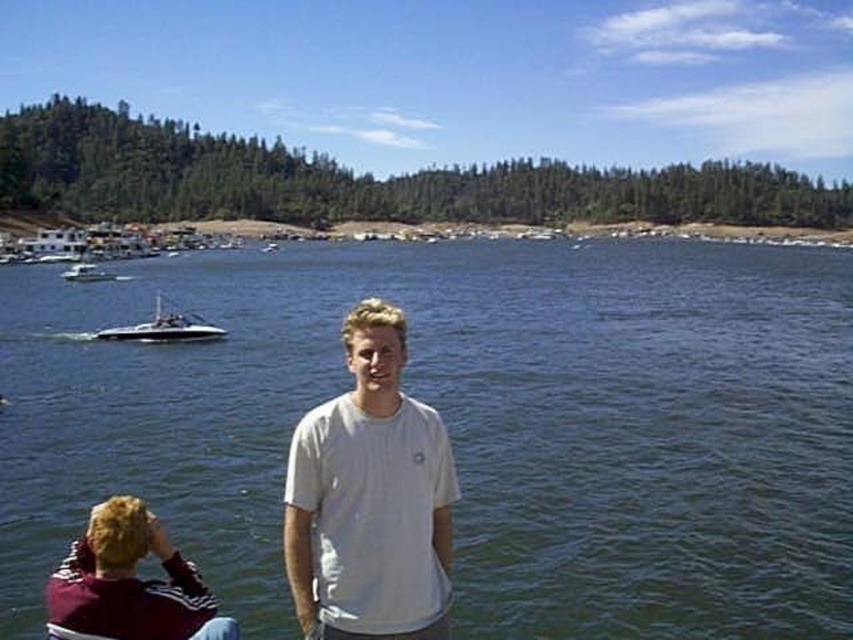
You are standing at the camera position and want to hand a camera to the person wearing the maroon fabric shirt at lower left. Can you directly hand it to them without walking closer?

The maroon fabric shirt at lower left and camera are 16.94 meters apart, so you cannot directly hand the camera to them without walking closer because the distance is too far.

You are standing at the point with coordinates point (277, 248) and want to walk towards the lake. Which direction should you go to reach the lake first, towards point (402, 449) or away from it?

Since point (402, 449) is in front of point (277, 248), moving towards point (402, 449) would lead you closer to the lake faster than moving away from it.

You are standing at the camera position and want to reach the point marked as point (840, 476). If your walking speed is 1.5 meters per second, how many seconds will it take you to reach that point?

The point (840, 476) is 28.46 meters away from the camera. At a speed of 1.5 meters per second, it would take approximately 19 seconds to reach the point.